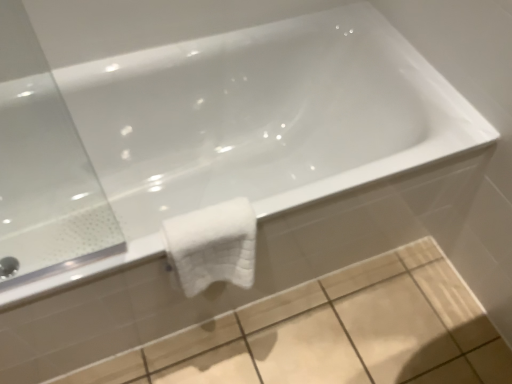
Identify the location of vacant area on top of white soft towel at lower center (from a real-world perspective). click(x=208, y=220).